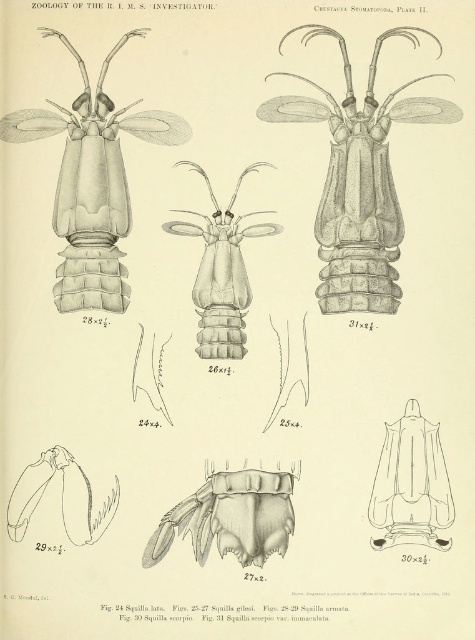
You are examining the scientific illustration of the Squilla species from the Zoology publication. The illustration includes a translucent gray exoskeleton at center. Based on its coordinates, is this exoskeleton positioned closer to the top or bottom of the image?

The translucent gray exoskeleton at center is located at point 0.809 on the y axis, which places it closer to the bottom of the image since higher y values are typically at the bottom in coordinate systems like this.

You are a researcher examining the illustration. You need to determine if the translucent gray exoskeleton at center can fit through a narrow opening that is just wide enough for the transparent plastic scorpion at lower right. Can it pass through?

The translucent gray exoskeleton at center might be wider than the transparent plastic scorpion at lower right, so it may not fit through the narrow opening if it is only wide enough for the transparent plastic scorpion at lower right.

Based on the illustration from the zoology publication, which object at the center of the image takes up more area? The translucent gray exoskeleton at center or the transparent glass insect at center?

The transparent glass insect at center takes up more area than the translucent gray exoskeleton at center because the translucent gray exoskeleton at center occupies less space than transparent glass insect at center.